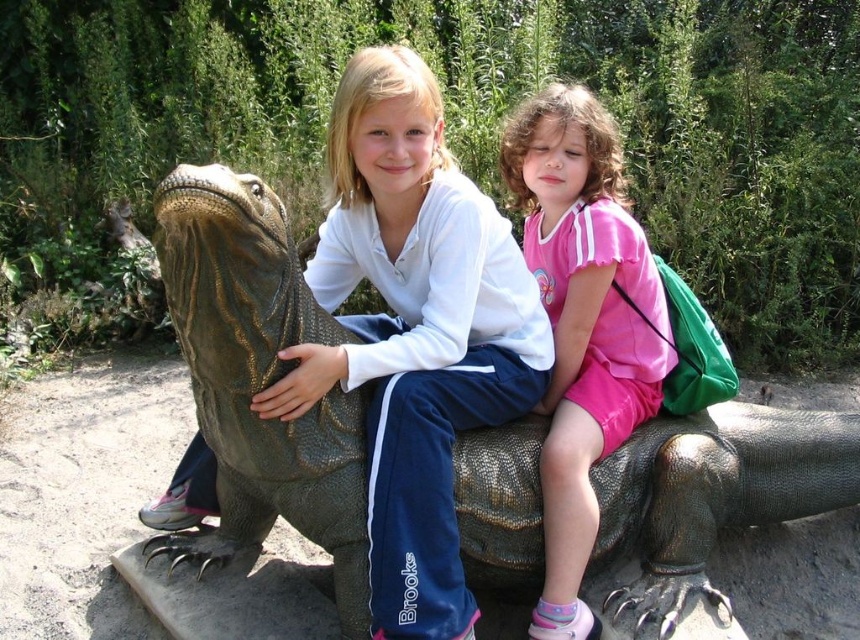
Question: Which of the following is the closest to the observer?

Choices:
 (A) (250, 516)
 (B) (424, 360)

Answer: (B)

Question: Based on their relative distances, which object is farther from the matte green lizard at center?

Choices:
 (A) shiny green scales at center
 (B) pink shiny shorts at lower right

Answer: (B)

Question: Does shiny green scales at center have a larger size compared to matte green lizard at center?

Choices:
 (A) no
 (B) yes

Answer: (B)

Question: Which point is farther to the camera?

Choices:
 (A) pink shiny shorts at lower right
 (B) matte green lizard at center
 (C) shiny green scales at center

Answer: (A)

Question: Is shiny green scales at center bigger than matte green lizard at center?

Choices:
 (A) yes
 (B) no

Answer: (A)

Question: Is matte green lizard at center behind pink shiny shorts at lower right?

Choices:
 (A) no
 (B) yes

Answer: (A)